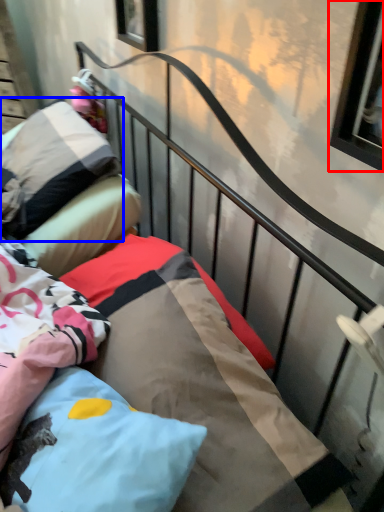
Question: Which point is further to the camera, window (highlighted by a red box) or pillow (highlighted by a blue box)?

Choices:
 (A) window
 (B) pillow

Answer: (B)